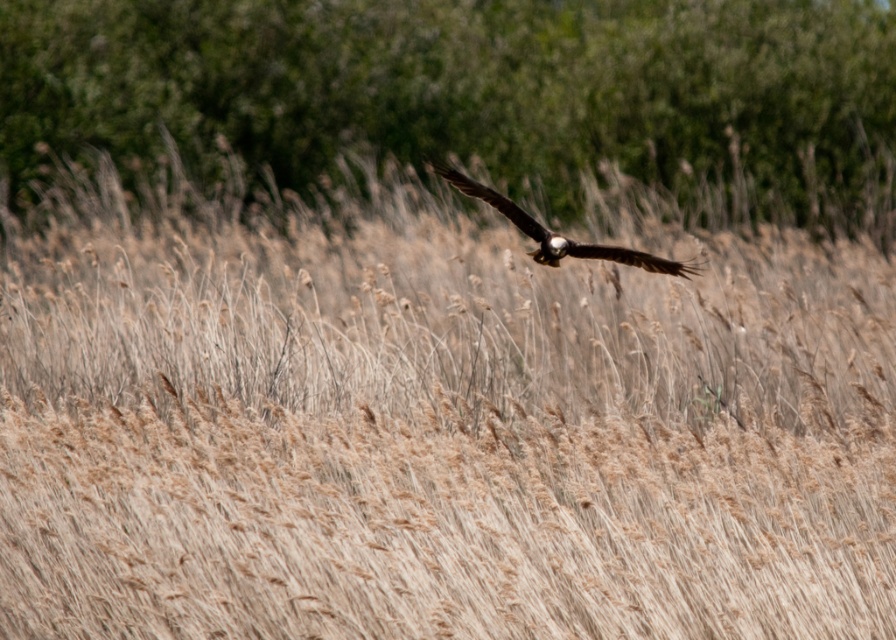
You are a birdwatcher observing the scene. You notice the green leafy tree at upper center and the brown feathered eagle at center. Which object is positioned to the left of the other?

The green leafy tree at upper center is to the left of the brown feathered eagle at center.

You are a birdwatcher trying to observe the brown feathered eagle at center. From your position, can you see the eagle clearly through the green leafy tree at upper center?

The brown feathered eagle at center is behind the green leafy tree at upper center, so the tree would block your view of the eagle.

You are a birdwatcher trying to identify the brown feathered eagle at center. You notice another object in the scene, the green leafy tree at upper center. Which object is wider?

The green leafy tree at upper center is wider than the brown feathered eagle at center according to the description.